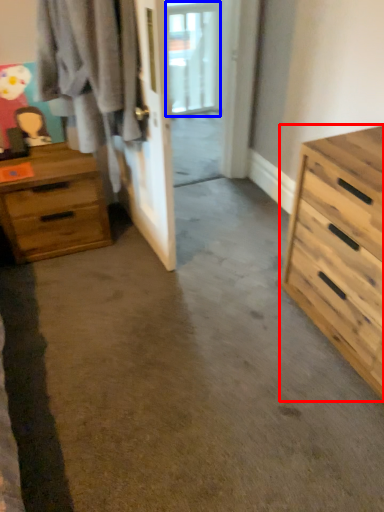
Question: Which of the following is the closest to the observer, chest of drawers (highlighted by a red box) or window (highlighted by a blue box)?

Choices:
 (A) chest of drawers
 (B) window

Answer: (A)